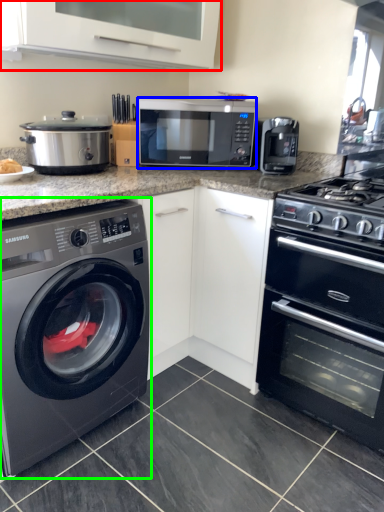
Question: Considering the real-world distances, which object is farthest from vent (highlighted by a red box)? microwave oven (highlighted by a blue box) or washing machine (highlighted by a green box)?

Choices:
 (A) microwave oven
 (B) washing machine

Answer: (B)